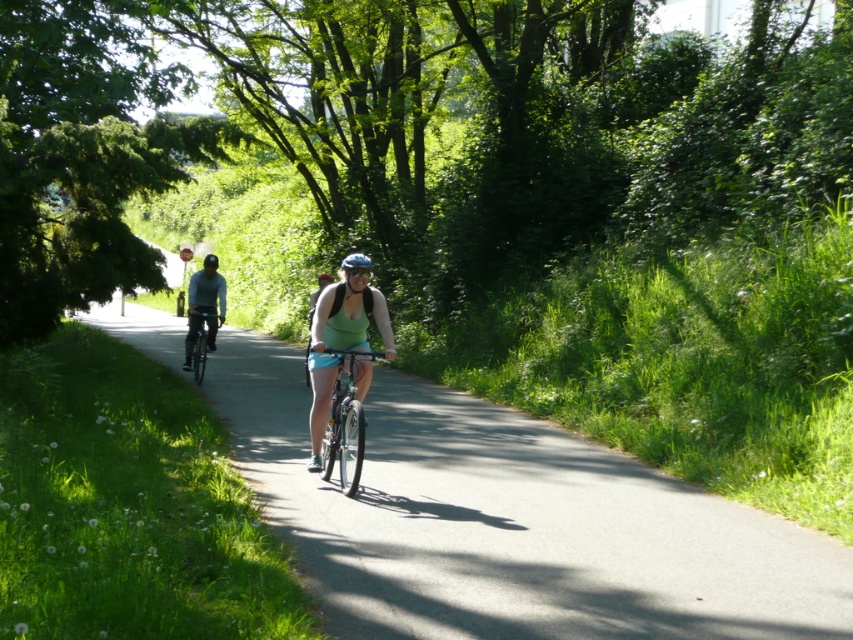
Does shiny black bicycle at center appear over blue matte bicycle helmet at center?

No.

Which of these two, shiny black bicycle at center or blue matte bicycle helmet at center, stands shorter?

shiny black bicycle at center

Which is behind, point (216, 316) or point (366, 257)?

The point (366, 257) is more distant.

You are a GUI agent. You are given a task and a screenshot of the screen. Output one action in this format:
    pyautogui.click(x=<x>, y=<y>)
    Task: Click on the shiny black bicycle at center
    
    Given the screenshot: What is the action you would take?
    pyautogui.click(x=201, y=340)

Measure the distance between shiny metallic bicycle at center and camera.

shiny metallic bicycle at center and camera are 8.34 meters apart from each other.

At what (x,y) coordinates should I click in order to perform the action: click on shiny metallic bicycle at center. Please return your answer as a coordinate pair (x, y). Looking at the image, I should click on (344, 422).

Who is shorter, asphalt road at center or shiny metallic bicycle at center?

With less height is shiny metallic bicycle at center.

Who is positioned more to the right, asphalt road at center or shiny metallic bicycle at center?

Positioned to the right is shiny metallic bicycle at center.

At what (x,y) coordinates should I click in order to perform the action: click on asphalt road at center. Please return your answer as a coordinate pair (x, y). Image resolution: width=853 pixels, height=640 pixels. Looking at the image, I should click on (511, 522).

The height and width of the screenshot is (640, 853). Find the location of `asphalt road at center`. asphalt road at center is located at coordinates (511, 522).